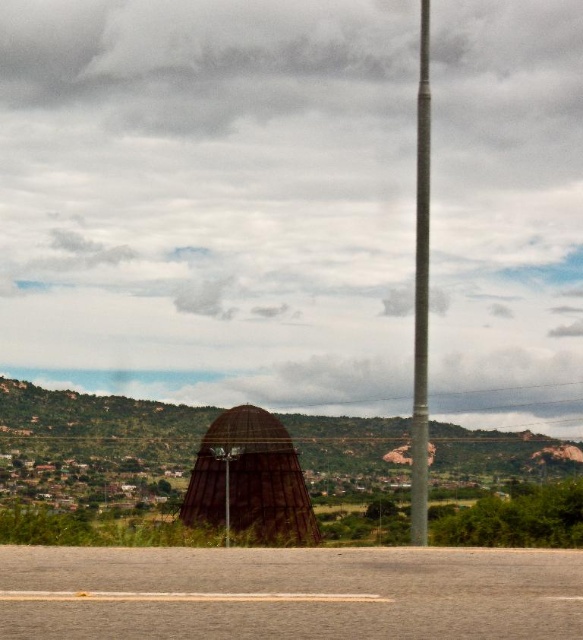
Question: Estimate the real-world distances between objects in this image. Which object is closer to the brown textured dome at center?

Choices:
 (A) metallic pole at right
 (B) metallic pole at center

Answer: (A)

Question: In this image, where is brown textured dome at center located relative to metallic pole at right?

Choices:
 (A) right
 (B) left

Answer: (B)

Question: Can you confirm if brown textured dome at center is wider than metallic pole at right?

Choices:
 (A) yes
 (B) no

Answer: (A)

Question: Which of these objects is positioned farthest from the metallic pole at center?

Choices:
 (A) metallic pole at right
 (B) brown textured dome at center

Answer: (B)

Question: Is metallic pole at right bigger than metallic pole at center?

Choices:
 (A) yes
 (B) no

Answer: (A)

Question: Which point is closer to the camera taking this photo?

Choices:
 (A) (220, 458)
 (B) (412, 486)

Answer: (B)